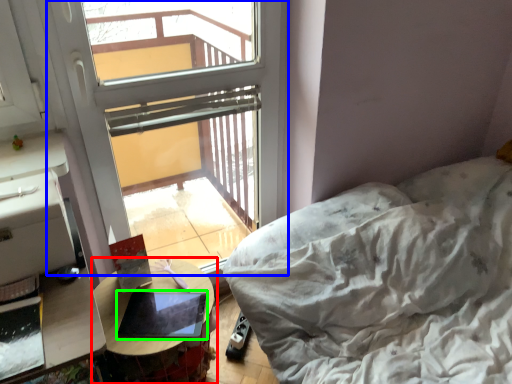
Question: Estimate the real-world distances between objects in this image. Which object is farther from table (highlighted by a red box), window (highlighted by a blue box) or laptop (highlighted by a green box)?

Choices:
 (A) window
 (B) laptop

Answer: (A)